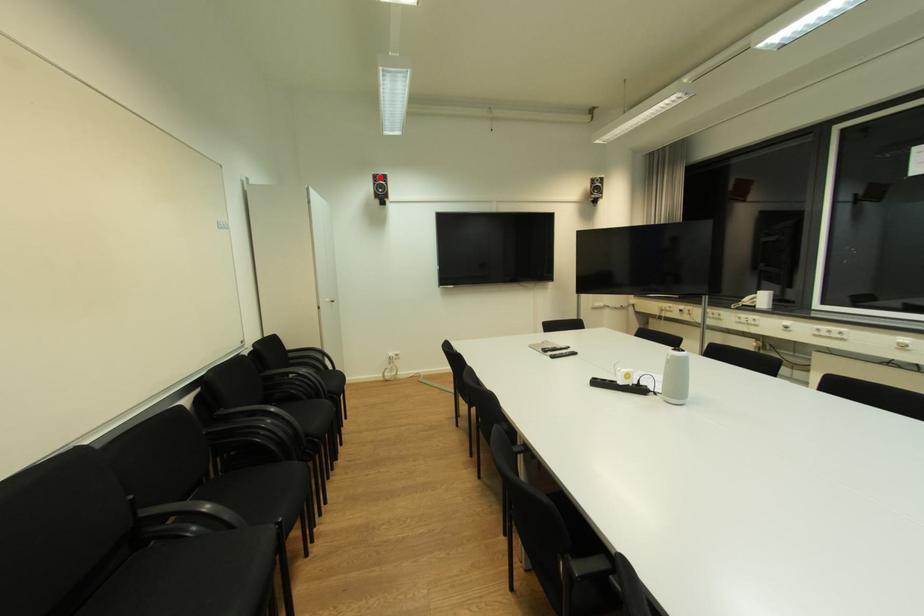
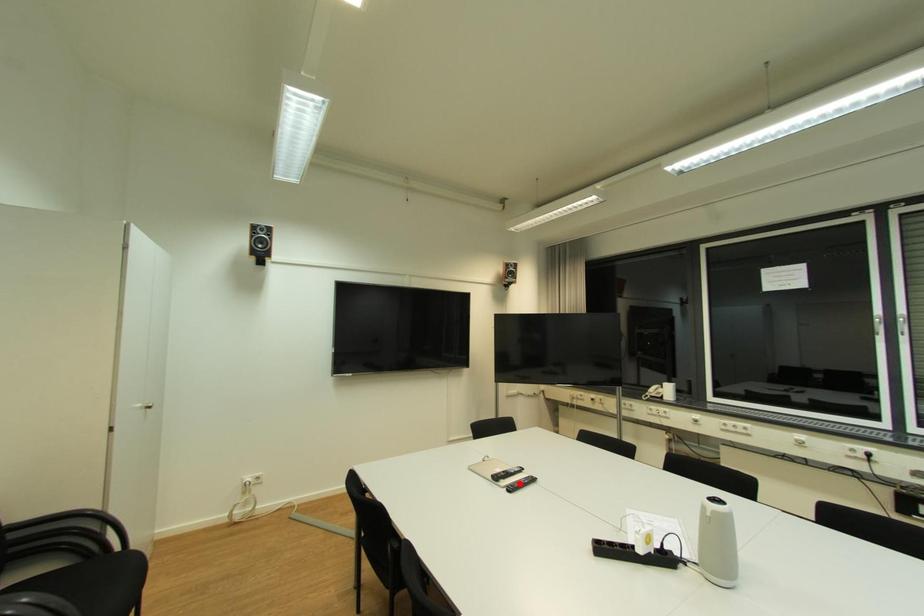
I am providing you with two images of the same scene from different viewpoints. A red point is marked on the first image and another point is marked on the second image. Is the red point in image1 aligned with the point shown in image2?

No